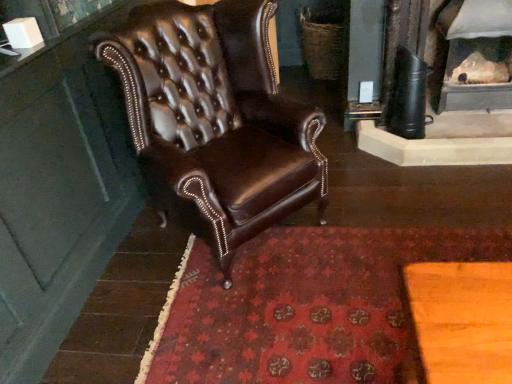
What are the coordinates of `vacant space in brown leather chair at center (from a real-world perspective)` in the screenshot? It's located at [239, 258].